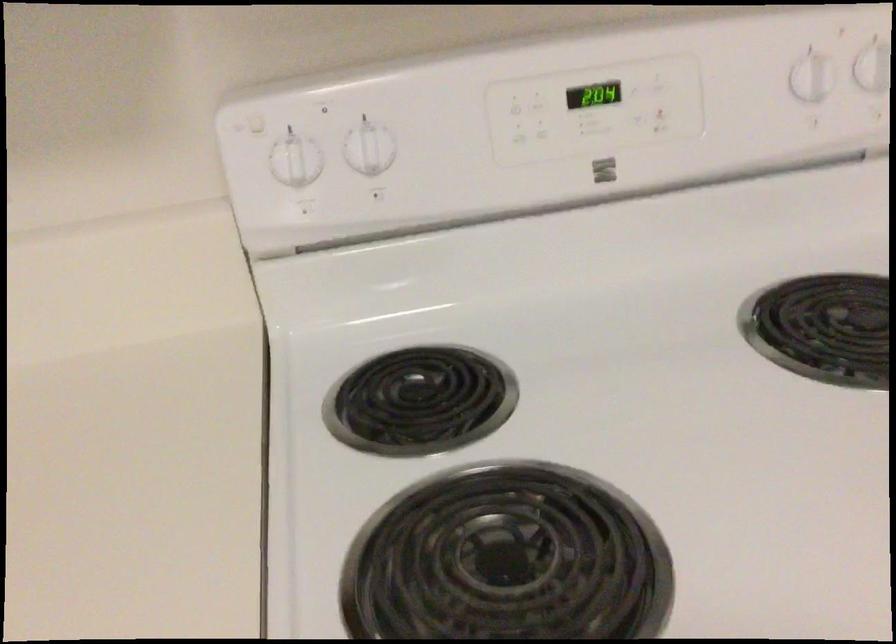
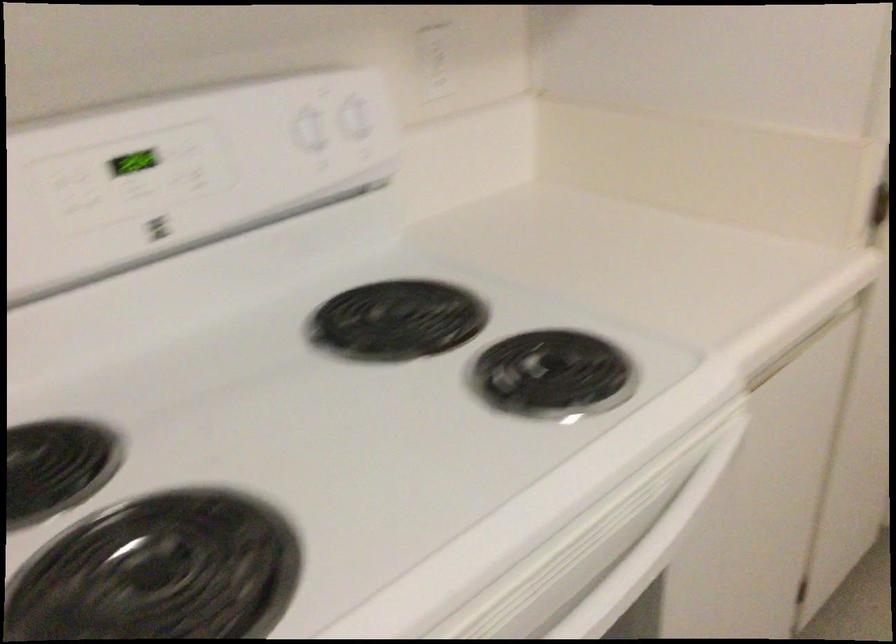
Question: The images are taken continuously from a first-person perspective. In which direction is your viewpoint rotating?

Choices:
 (A) Left
 (B) Right
 (C) Up
 (D) Down

Answer: (B)